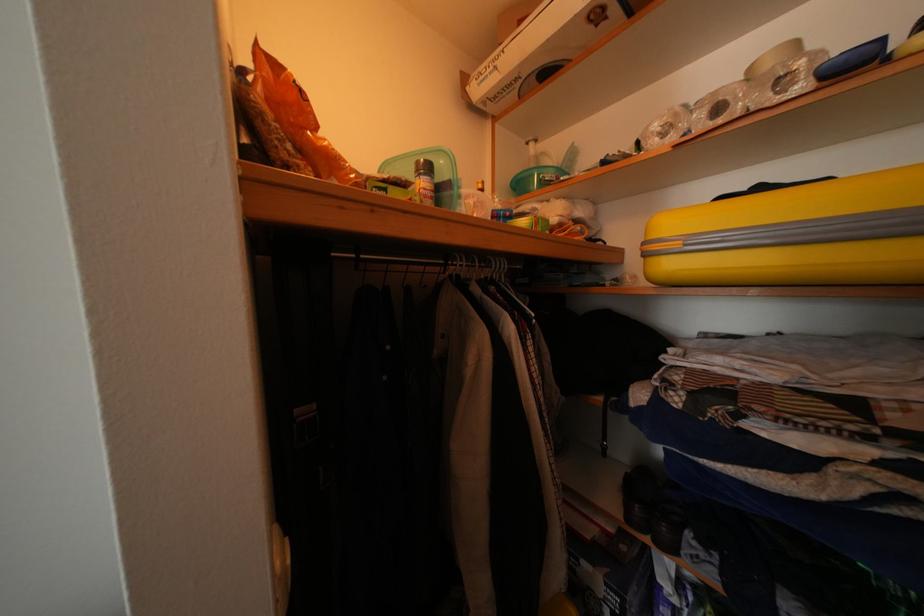
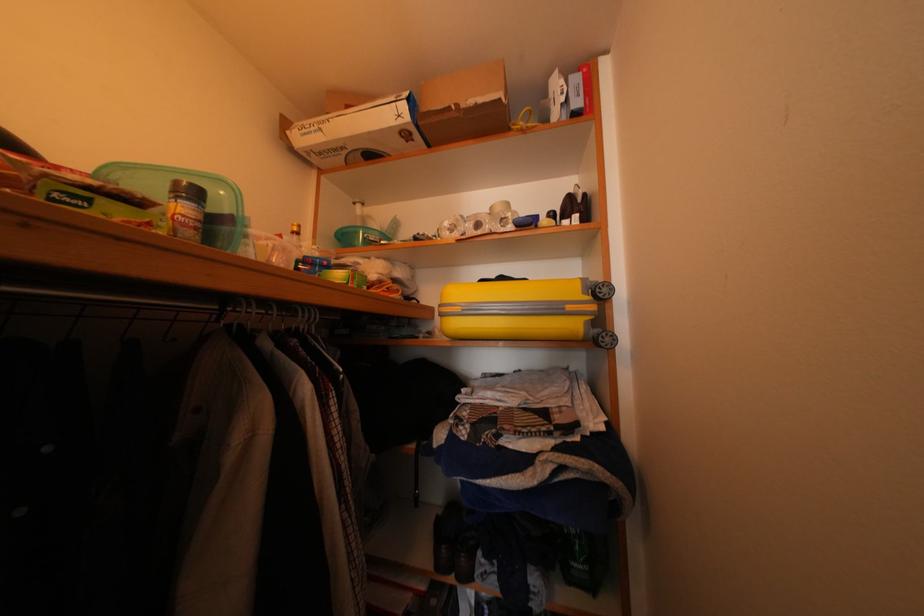
Question: The camera is either moving clockwise (left) or counter-clockwise (right) around the object. The first image is from the beginning of the video and the second image is from the end. Is the camera moving left or right when shooting the video?

Choices:
 (A) Left
 (B) Right

Answer: (A)